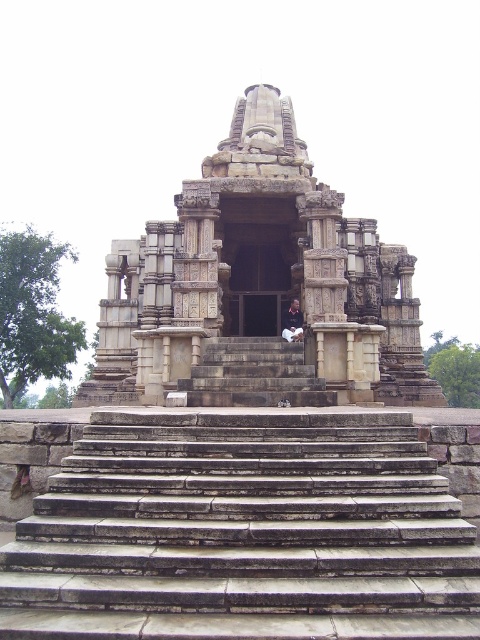
Question: Which object appears farthest from the camera in this image?

Choices:
 (A) stone stairs at center
 (B) beige stone hindu temple at center

Answer: (B)

Question: Is brown stone stairs at center thinner than beige stone hindu temple at center?

Choices:
 (A) no
 (B) yes

Answer: (B)

Question: Is brown stone stairs at center to the right of beige stone hindu temple at center from the viewer's perspective?

Choices:
 (A) no
 (B) yes

Answer: (A)

Question: Which point is closer to the camera taking this photo?

Choices:
 (A) (180, 356)
 (B) (297, 445)

Answer: (B)

Question: Is beige stone hindu temple at center positioned behind stone stairs at center?

Choices:
 (A) yes
 (B) no

Answer: (A)

Question: Which object is farther from the camera taking this photo?

Choices:
 (A) beige stone hindu temple at center
 (B) brown stone stairs at center

Answer: (A)